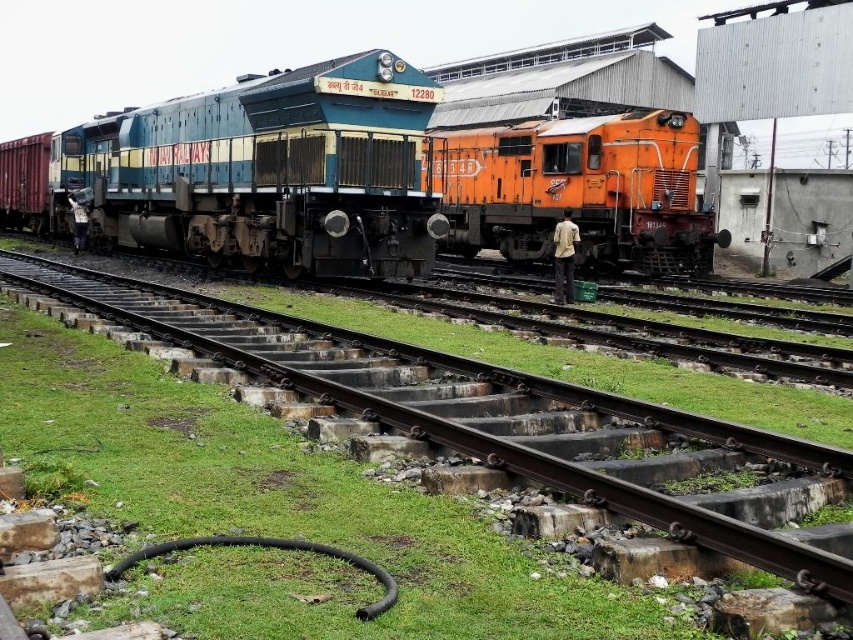
You are a railway worker inspecting the tracks. You notice the orange metallic train at right and the green grass at lower left. Which object is positioned higher relative to the other?

The orange metallic train at right is located above the green grass at lower left, so it is positioned higher.

You are a railway worker standing at the edge of the tracks. You need to cross to the orange metallic train at right to inspect it. However, there is green grass at lower left blocking your path. Which direction should you move to avoid the grass?

The orange metallic train at right is closer to you than the green grass at lower left, so you should move towards the orange metallic train at right to avoid the grass.

You are a maintenance worker who needs to inspect both the blue metallic locomotive at center and the orange metallic train at right. Considering their sizes, which one would require a taller ladder for inspection tasks?

The blue metallic locomotive at center requires a taller ladder because it is much taller than the orange metallic train at right according to the description.